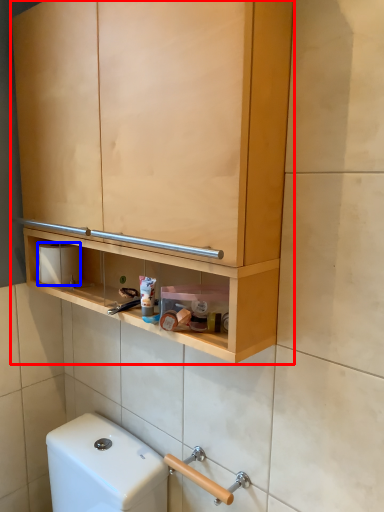
Question: Among these objects, which one is farthest to the camera, cabinetry (highlighted by a red box) or toilet paper (highlighted by a blue box)?

Choices:
 (A) cabinetry
 (B) toilet paper

Answer: (B)